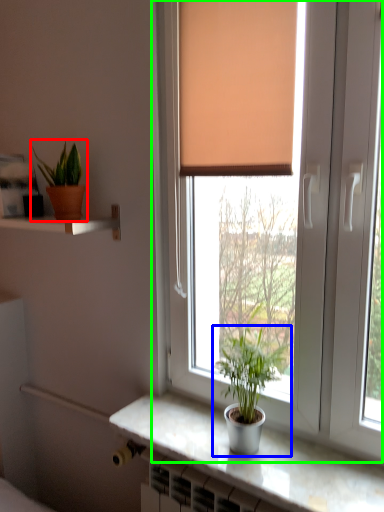
Question: Estimate the real-world distances between objects in this image. Which object is closer to houseplant (highlighted by a red box), houseplant (highlighted by a blue box) or window (highlighted by a green box)?

Choices:
 (A) houseplant
 (B) window

Answer: (B)